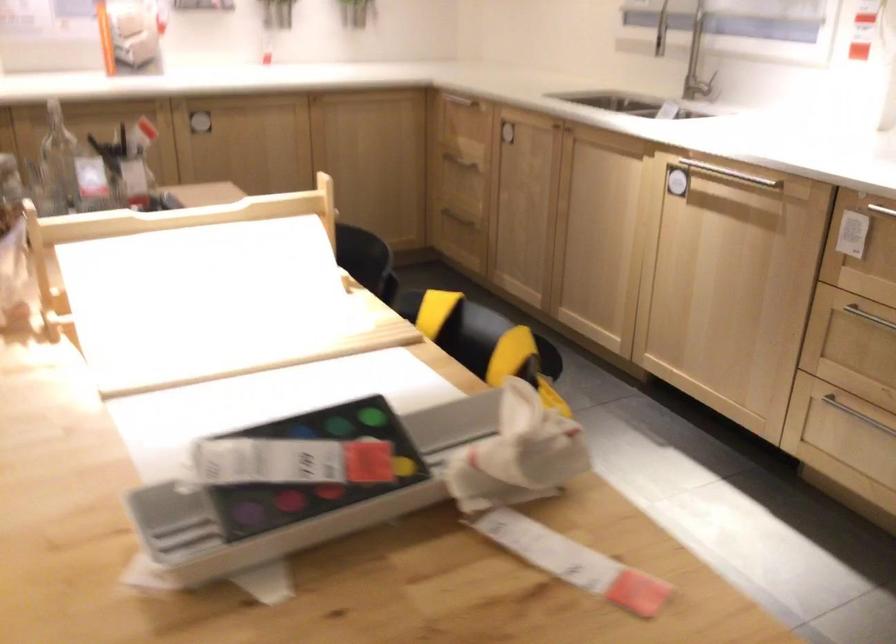
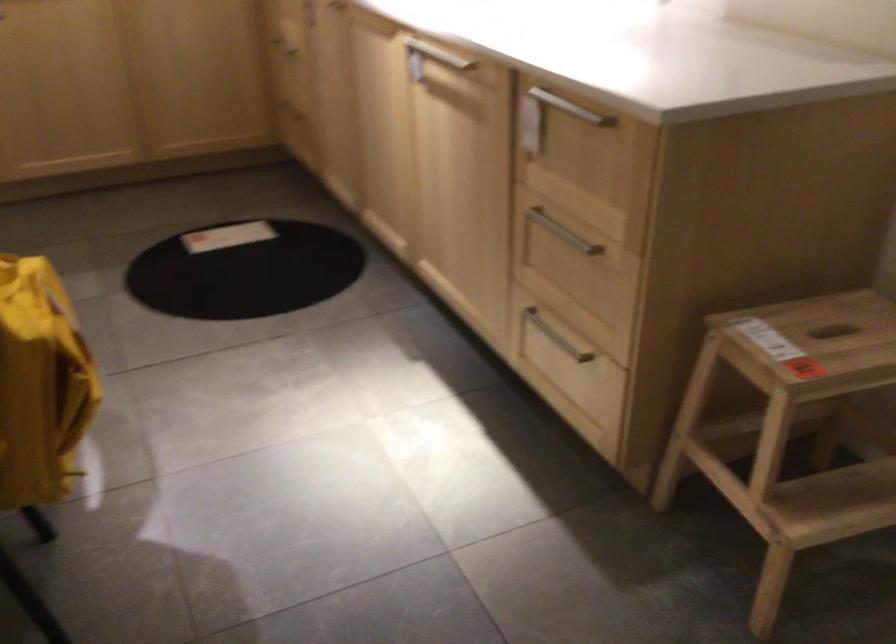
Question: What movement of the cameraman would produce the second image?

Choices:
 (A) Left
 (B) Right
 (C) Forward
 (D) Backward

Answer: (B)